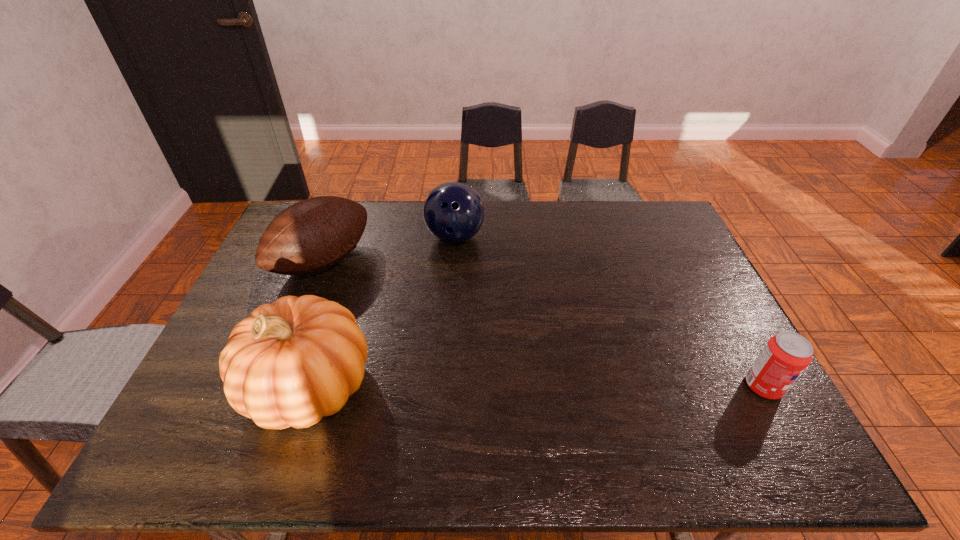
Locate an element on the screen. This screenshot has height=540, width=960. pumpkin is located at coordinates point(290,363).

You are a GUI agent. You are given a task and a screenshot of the screen. Output one action in this format:
    pyautogui.click(x=<x>, y=<y>)
    Task: Click on the soda can
    This screenshot has width=960, height=540.
    Given the screenshot: What is the action you would take?
    pyautogui.click(x=786, y=355)

You are a GUI agent. You are given a task and a screenshot of the screen. Output one action in this format:
    pyautogui.click(x=<x>, y=<y>)
    Task: Click on the shortest object
    This screenshot has height=540, width=960.
    Given the screenshot: What is the action you would take?
    pyautogui.click(x=786, y=355)

What are the coordinates of `football` in the screenshot? It's located at (312, 235).

Identify the location of the third object from left to right. The height and width of the screenshot is (540, 960). (453, 212).

This screenshot has width=960, height=540. What are the coordinates of `vacant space located on the right of the tallest object` in the screenshot? It's located at (497, 386).

Identify the location of vacant position located 0.220m on the laces of the football. (396, 318).

The image size is (960, 540). Find the location of `vacant space located 0.290m on the laces of the football`. vacant space located 0.290m on the laces of the football is located at coordinates (414, 330).

Identify the location of free space located on the laces of the football. The width and height of the screenshot is (960, 540). (403, 323).

You are a GUI agent. You are given a task and a screenshot of the screen. Output one action in this format:
    pyautogui.click(x=<x>, y=<y>)
    Task: Click on the free space located on the surface of the bowling ball near the finger holes
    Image resolution: width=960 pixels, height=540 pixels.
    Given the screenshot: What is the action you would take?
    pyautogui.click(x=464, y=267)